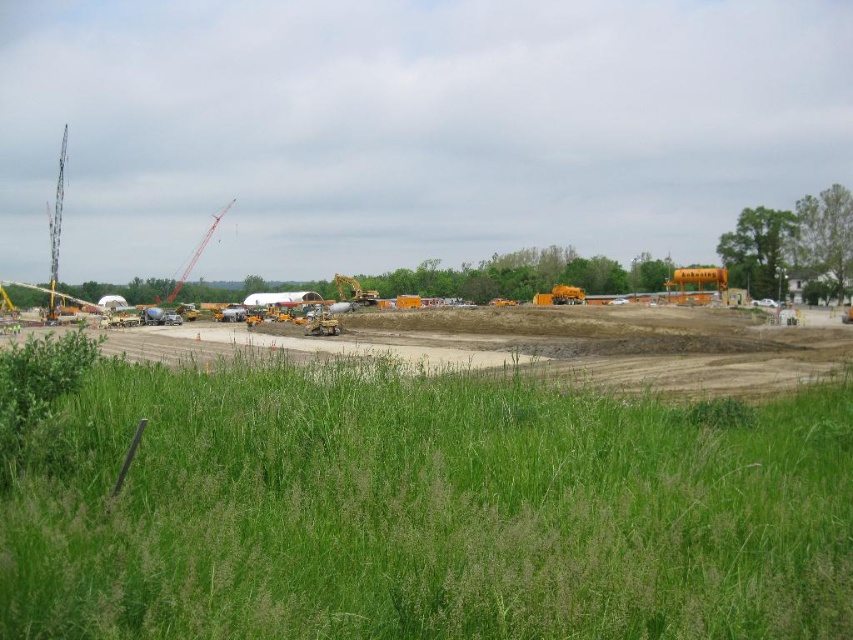
Question: Is green grass at lower center above orange metallic crane at left?

Choices:
 (A) yes
 (B) no

Answer: (B)

Question: Estimate the real-world distances between objects in this image. Which object is closer to the green grass at lower center?

Choices:
 (A) yellow earth at center
 (B) yellow metallic excavator at center
 (C) orange metallic crane at left

Answer: (A)

Question: Among these points, which one is farthest from the camera?

Choices:
 (A) pos(339,282)
 (B) pos(556,412)

Answer: (A)

Question: Is orange metallic crane at left to the right of yellow metallic excavator at center from the viewer's perspective?

Choices:
 (A) yes
 (B) no

Answer: (B)

Question: Estimate the real-world distances between objects in this image. Which object is farther from the orange metallic crane at left?

Choices:
 (A) green grass at lower center
 (B) yellow earth at center
 (C) yellow metallic excavator at center

Answer: (A)

Question: Is green grass at lower center positioned in front of orange metallic crane at left?

Choices:
 (A) yes
 (B) no

Answer: (A)